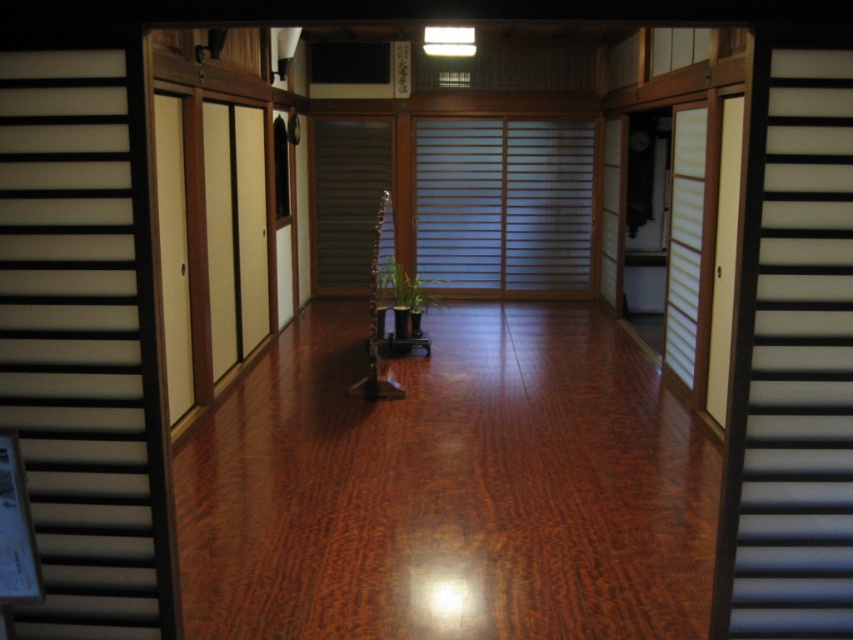
You are a visitor in this Japanese room and want to go upstairs. You see the black wood stair at right and the brown wooden stairs at center. Which one should you use to go upstairs?

Both the black wood stair at right and the brown wooden stairs at center lead upstairs. However, the black wood stair at right is located below the brown wooden stairs at center, so you should use the brown wooden stairs at center to go upstairs since it is positioned higher up.

You are a guest entering a traditional Japanese room. You see a white matte sliding door at left and a black wood stair at right. Which object is closer to the floor?

The white matte sliding door at left is closer to the floor because it is below the black wood stair at right.